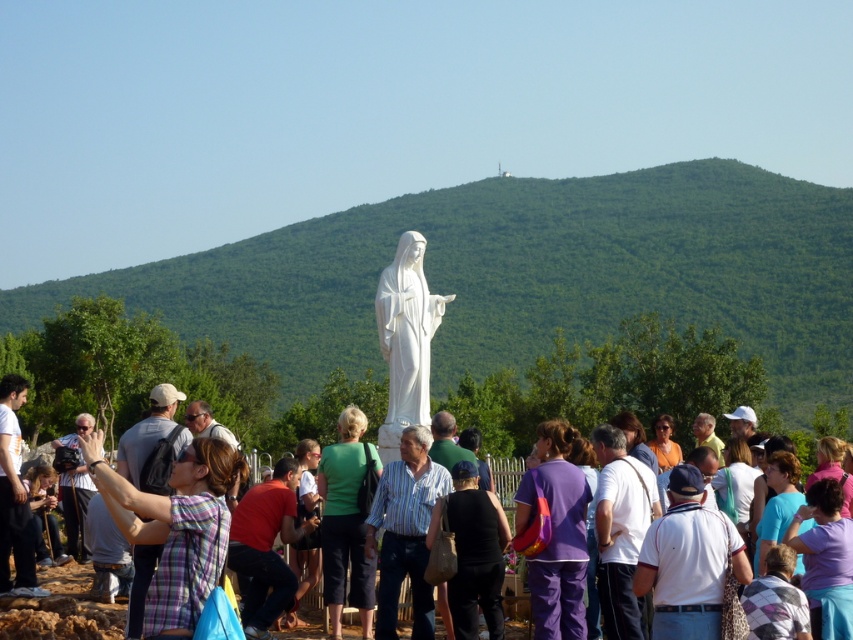
You are organizing a community event and need to place a sign between the black fabric bag at center and the purple fabric at center. Which side of the sign should you align with the wider object to ensure proper spacing?

The black fabric bag at center is wider than the purple fabric at center. To ensure proper spacing, align the sign with the side nearest to the black fabric bag at center.

You are a photographer trying to capture a photo of the purple fabric at center without including the red shirt at center in the frame. Based on the scene description, can you position yourself in a way to achieve this? Explain your reasoning.

The red shirt at center is to the left of the purple fabric at center. To avoid including the red shirt at center in the photo, position yourself to the right side of the purple fabric at center so that the red shirt at center is out of the frame.

You are a photographer at the scene and want to capture both the purple fabric pants at center and the plaid shirt at lower left in the same frame. Which object should you focus on first to ensure both are in focus?

The purple fabric pants at center has a greater height compared to plaid shirt at lower left. To ensure both are in focus, you should focus on the purple fabric pants at center first since it is taller and likely farther away, allowing the plaid shirt at lower left to fall within the depth of field.